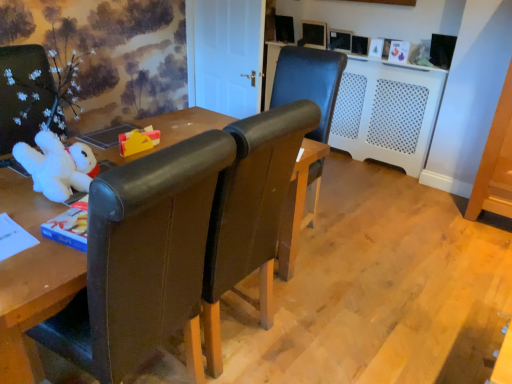
Identify the location of space that is in front of white plush toy at left, which is the second toy in back-to-front order. (38, 213).